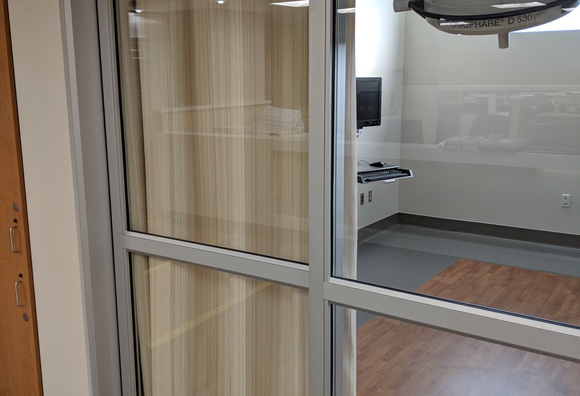
Locate an element on the screen. This screenshot has width=580, height=396. gray floor behind window glass is located at coordinates (556, 265), (414, 240), (379, 274), (361, 316).